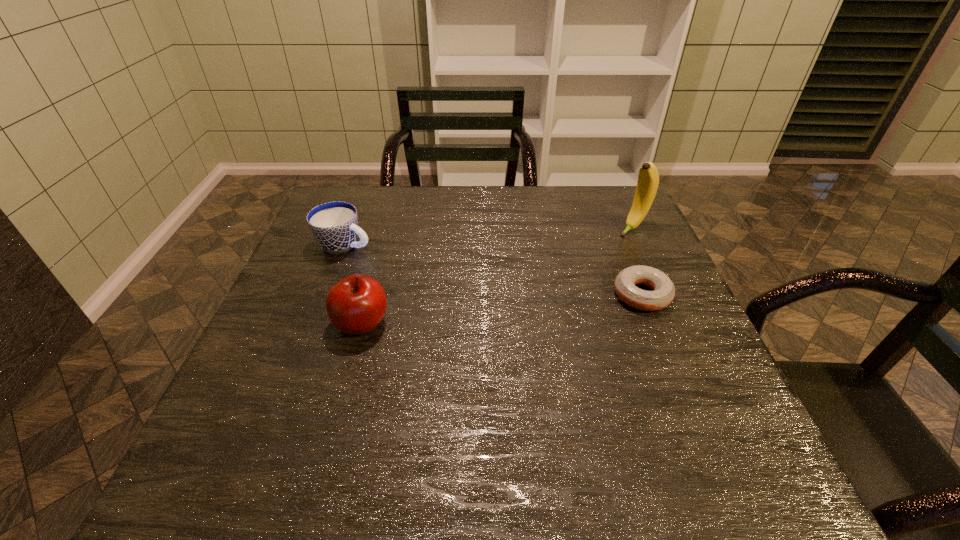
Identify the location of apple. Image resolution: width=960 pixels, height=540 pixels. (356, 304).

The image size is (960, 540). I want to click on the shortest object, so click(x=664, y=291).

I want to click on banana, so click(648, 179).

This screenshot has width=960, height=540. In order to click on the second shortest object in this screenshot , I will do `click(334, 225)`.

This screenshot has width=960, height=540. I want to click on vacant space located on the right of the third shortest object, so click(520, 323).

At what (x,y) coordinates should I click in order to perform the action: click on vacant area located 0.120m on the back of the doughnut. Please return your answer as a coordinate pair (x, y). The image size is (960, 540). Looking at the image, I should click on (623, 247).

This screenshot has height=540, width=960. What are the coordinates of `free spot located 0.310m from the stem of the tallest object` in the screenshot? It's located at (558, 289).

Find the location of a particular element. This screenshot has width=960, height=540. free space located 0.390m from the stem of the tallest object is located at coordinates (537, 306).

Locate an element on the screen. This screenshot has width=960, height=540. blank area located 0.280m from the stem of the tallest object is located at coordinates (564, 283).

You are a GUI agent. You are given a task and a screenshot of the screen. Output one action in this format:
    pyautogui.click(x=<x>, y=<y>)
    Task: Click on the free space located 0.090m on the side of the cup with the handle
    This screenshot has height=540, width=960.
    Given the screenshot: What is the action you would take?
    pyautogui.click(x=397, y=260)